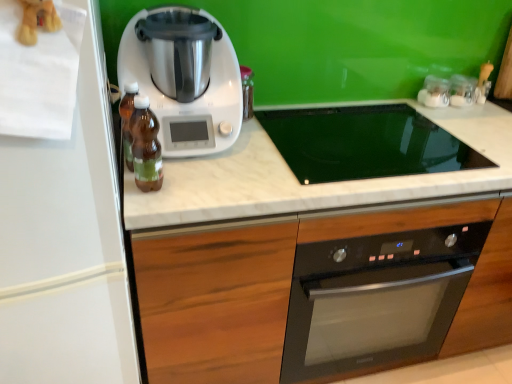
I want to click on free area in between brown glass bottle at center, marked as the second bottle in a back-to-front arrangement, and clear glass jars at upper right, marked as the first appliance in a right-to-left arrangement, so click(x=309, y=143).